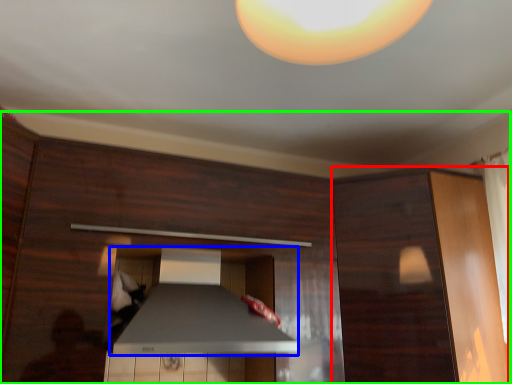
Question: Estimate the real-world distances between objects in this image. Which object is closer to cabinetry (highlighted by a red box), exhaust hood (highlighted by a blue box) or dresser (highlighted by a green box)?

Choices:
 (A) exhaust hood
 (B) dresser

Answer: (B)